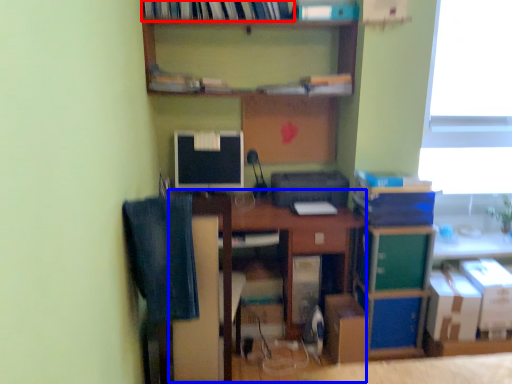
Question: Which of the following is the closest to the observer, book (highlighted by a red box) or computer desk (highlighted by a blue box)?

Choices:
 (A) book
 (B) computer desk

Answer: (A)